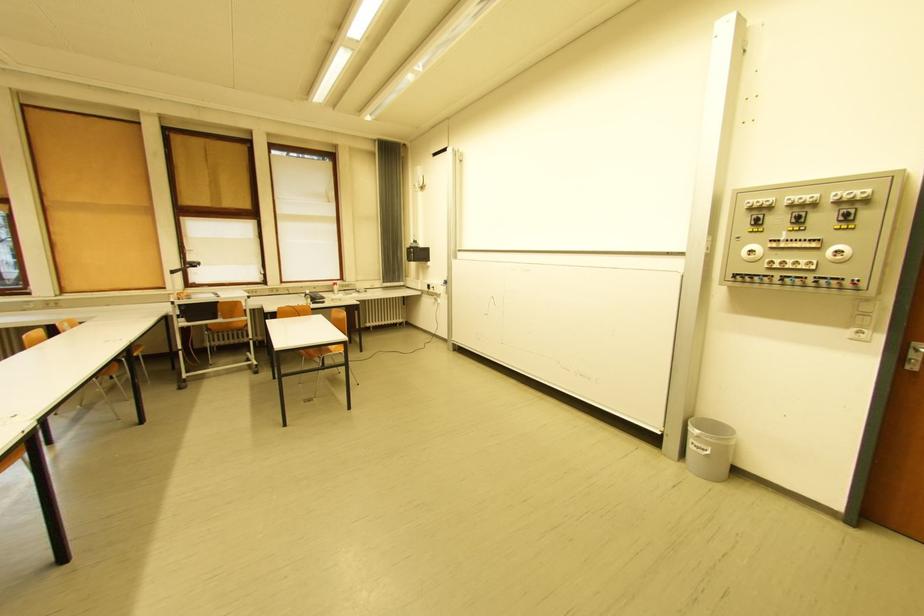
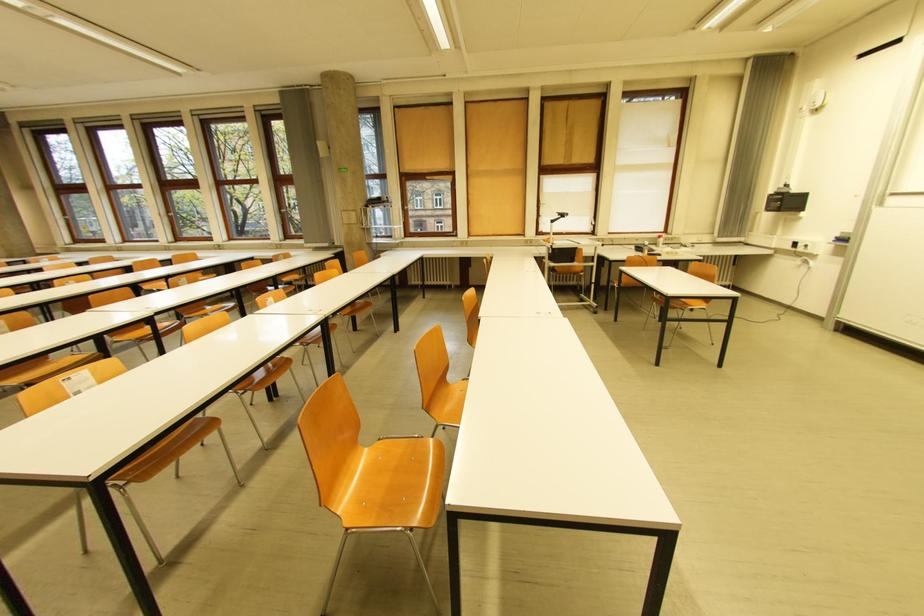
In the second image, find the point that corresponds to point 426,168 in the first image.

(823, 82)